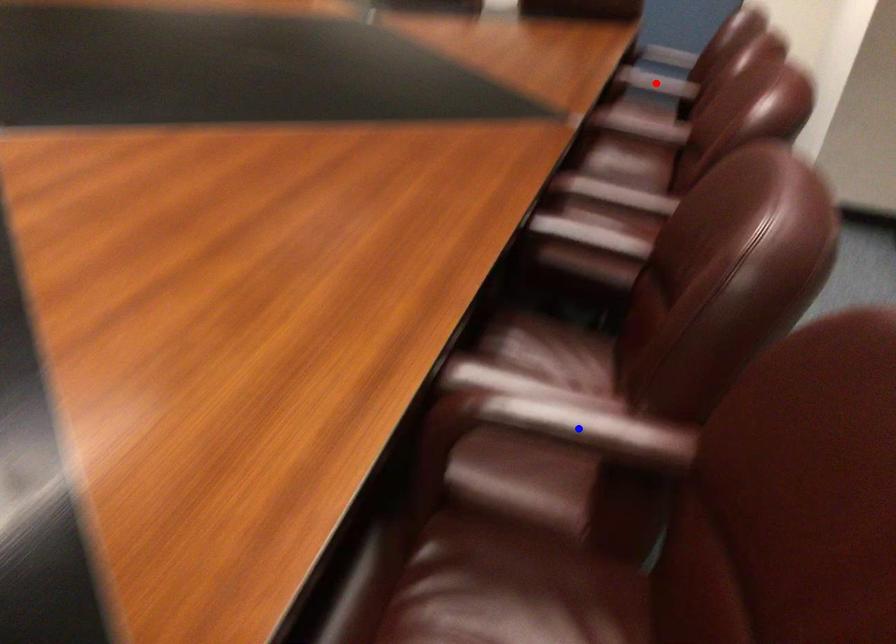
Question: In the image, two points are highlighted. Which point is nearer to the camera? Reply with the corresponding letter.

Choices:
 (A) blue point
 (B) red point

Answer: (A)